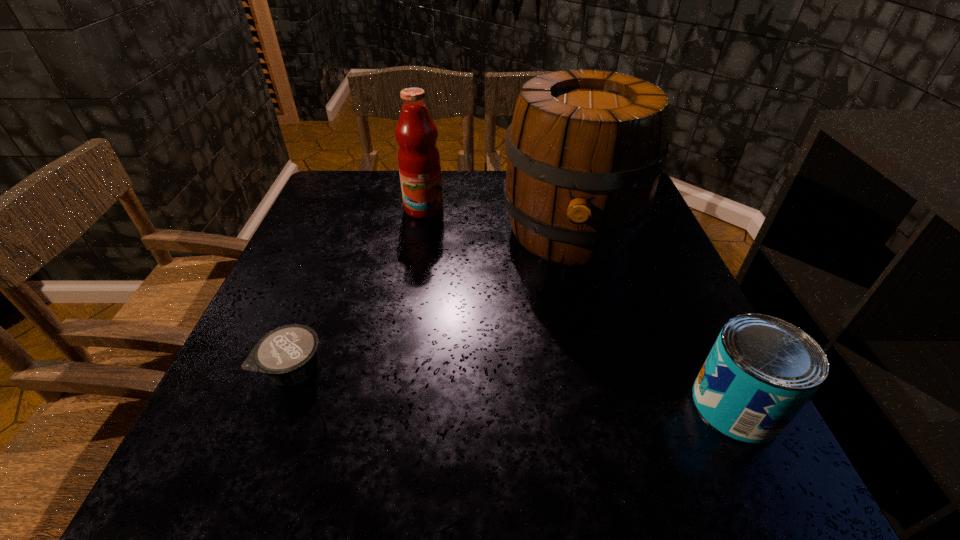
Locate an element on the screen. The image size is (960, 540). the shortest object is located at coordinates (288, 355).

The height and width of the screenshot is (540, 960). Identify the location of the leftmost object. (288, 355).

Where is `can`? Image resolution: width=960 pixels, height=540 pixels. can is located at coordinates (761, 371).

Locate an element on the screen. the third object from right to left is located at coordinates (419, 165).

Locate an element on the screen. This screenshot has height=540, width=960. cider is located at coordinates (585, 149).

I want to click on free space located 0.280m on the back of the shortest object, so click(x=338, y=254).

Where is `free space located on the back of the second shortest object`? Image resolution: width=960 pixels, height=540 pixels. free space located on the back of the second shortest object is located at coordinates (685, 300).

The width and height of the screenshot is (960, 540). Find the location of `vacant space located on the front label of the fruit juice`. vacant space located on the front label of the fruit juice is located at coordinates (430, 250).

The width and height of the screenshot is (960, 540). I want to click on vacant region located on the front label of the fruit juice, so click(x=440, y=309).

Find the location of a particular element. The height and width of the screenshot is (540, 960). free space located on the front label of the fruit juice is located at coordinates (433, 269).